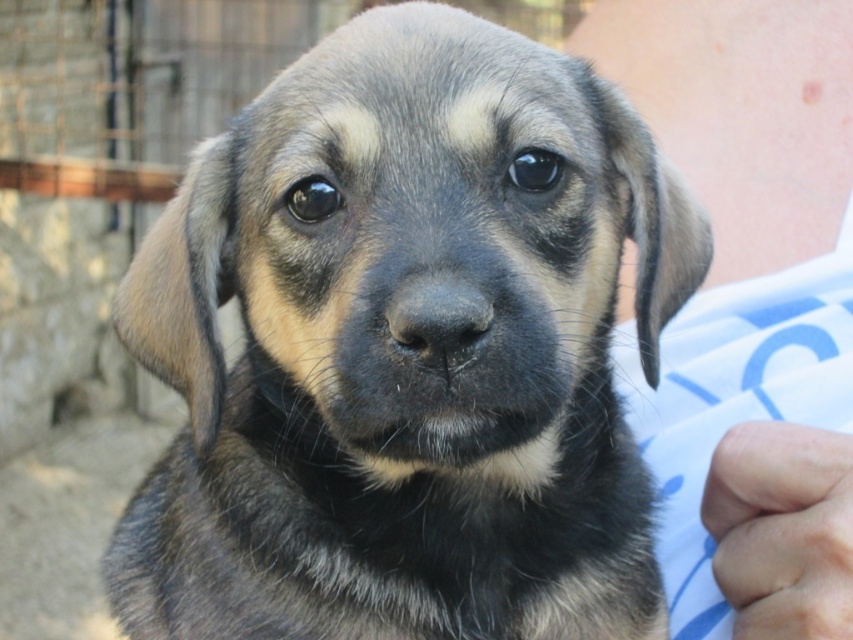
Question: Can you confirm if fuzzy fur puppy at center is smaller than skinny flesh at lower right?

Choices:
 (A) yes
 (B) no

Answer: (B)

Question: Is smooth skin at upper right bigger than skinny flesh at lower right?

Choices:
 (A) no
 (B) yes

Answer: (B)

Question: Which point appears closest to the camera in this image?

Choices:
 (A) (534, 312)
 (B) (717, 483)
 (C) (730, 518)

Answer: (A)

Question: Which of the following is the farthest from the observer?

Choices:
 (A) skinny flesh at lower right
 (B) fuzzy fur puppy at center
 (C) smooth skin at upper right

Answer: (C)

Question: Which point appears closest to the camera in this image?

Choices:
 (A) (815, 472)
 (B) (206, 493)
 (C) (822, 148)

Answer: (A)

Question: Is fuzzy fur puppy at center smaller than skinny flesh at lower right?

Choices:
 (A) no
 (B) yes

Answer: (A)